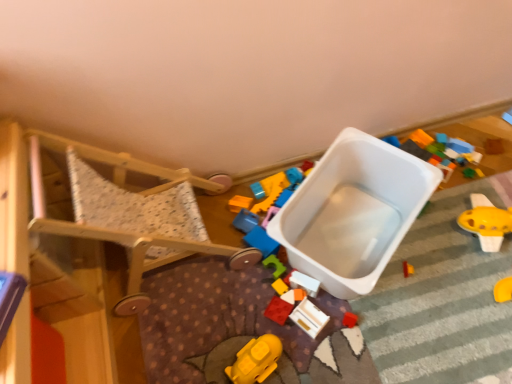
Question: Considering the positions of wooden toy at center, the second toy in the right-to-left sequence, and white plastic toy at center, the 3th toy positioned from the right, in the image, is wooden toy at center, the second toy in the right-to-left sequence, bigger or smaller than white plastic toy at center, the 3th toy positioned from the right,?

Choices:
 (A) small
 (B) big

Answer: (B)

Question: Considering the positions of point (314, 337) and point (303, 274), is point (314, 337) closer or farther from the camera than point (303, 274)?

Choices:
 (A) closer
 (B) farther

Answer: (A)

Question: Considering the real-world distances, which object is farthest from the white plastic storage box at center?

Choices:
 (A) white plastic toy at center, which ranks as the fourth toy in left-to-right order
 (B) wooden toy at center, the second toy in the right-to-left sequence
 (C) yellow matte toy at lower center, which is counted as the first toy, starting from the left
 (D) yellow plastic toy at right, which is counted as the first toy, starting from the right
 (E) rubberized red block at center, which appears as the fifth toy when viewed from the right

Answer: (C)

Question: Estimate the real-world distances between objects in this image. Which object is closer to the white plastic toy at center, the 3th toy positioned from the right?

Choices:
 (A) white plastic storage box at center
 (B) yellow plastic toy at right, which is counted as the first toy, starting from the right
 (C) wooden walker at left
 (D) rubberized red block at center, which appears as the fifth toy when viewed from the right
 (E) yellow matte toy at lower center, which is counted as the first toy, starting from the left

Answer: (D)